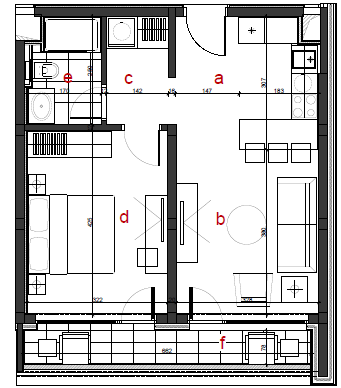
This screenshot has width=341, height=388. In order to click on cooktop in this screenshot , I will do `click(305, 97)`.